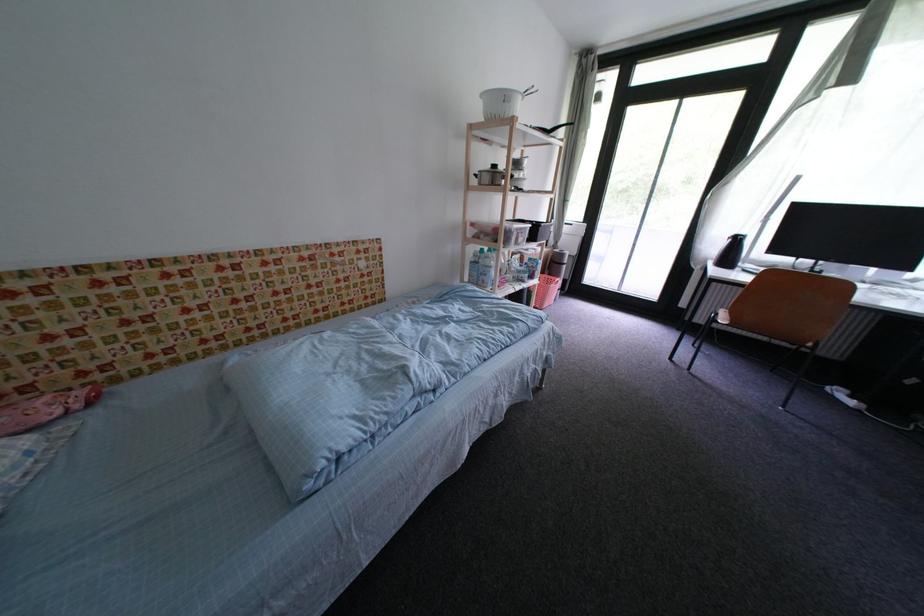
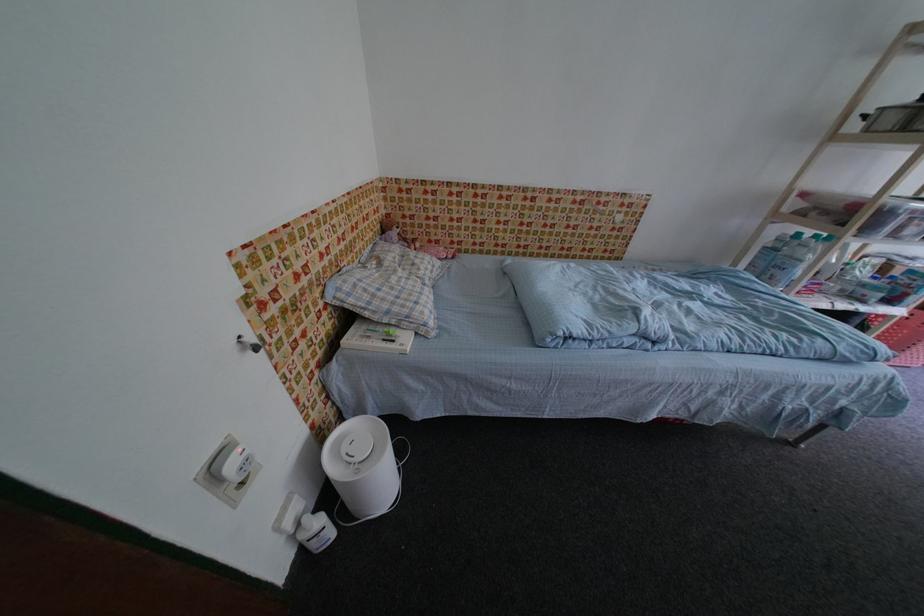
Where in the second image is the point corresponding to the point at 490,280 from the first image?

(782, 274)